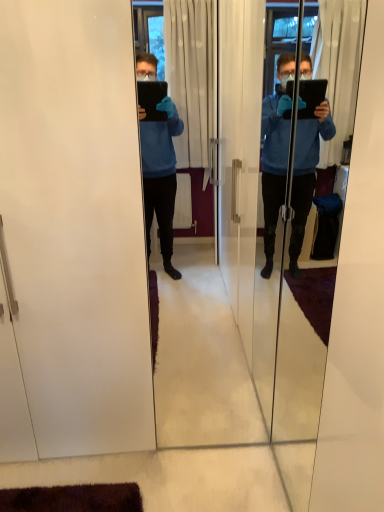
You are a GUI agent. You are given a task and a screenshot of the screen. Output one action in this format:
    pyautogui.click(x=<x>, y=<y>)
    Task: Click on the transparent glass tablet at center, which ranks as the first screen door in right-to-left order
    This screenshot has height=512, width=384.
    Given the screenshot: What is the action you would take?
    pyautogui.click(x=304, y=231)

This screenshot has height=512, width=384. What do you see at coordinates (304, 231) in the screenshot?
I see `transparent glass tablet at center, which ranks as the first screen door in right-to-left order` at bounding box center [304, 231].

Measure the distance between white matte screen door at left, the 1th screen door positioned from the left, and camera.

white matte screen door at left, the 1th screen door positioned from the left, is 1.20 meters from camera.

Locate an element on the screen. This screenshot has width=384, height=512. white matte screen door at left, placed as the second screen door when sorted from right to left is located at coordinates (72, 234).

What do you see at coordinates (72, 234) in the screenshot? I see `white matte screen door at left, the 1th screen door positioned from the left` at bounding box center [72, 234].

Identify the location of transparent glass tablet at center, which is the 2th screen door from left to right. The width and height of the screenshot is (384, 512). (304, 231).

Which object is positioned more to the left, white matte screen door at left, placed as the second screen door when sorted from right to left, or transparent glass tablet at center, which is the 2th screen door from left to right?

white matte screen door at left, placed as the second screen door when sorted from right to left.

Relative to transparent glass tablet at center, which is the 2th screen door from left to right, is white matte screen door at left, the 1th screen door positioned from the left, in front or behind?

white matte screen door at left, the 1th screen door positioned from the left, is behind transparent glass tablet at center, which is the 2th screen door from left to right.

Is point (59, 42) positioned behind point (279, 120)?

No, (59, 42) is in front of (279, 120).

From the image's perspective, between white matte screen door at left, placed as the second screen door when sorted from right to left, and transparent glass tablet at center, which ranks as the first screen door in right-to-left order, who is located below?

transparent glass tablet at center, which ranks as the first screen door in right-to-left order.

From a real-world perspective, is white matte screen door at left, the 1th screen door positioned from the left, above or below transparent glass tablet at center, which is the 2th screen door from left to right?

white matte screen door at left, the 1th screen door positioned from the left, is above transparent glass tablet at center, which is the 2th screen door from left to right.

Is white matte screen door at left, the 1th screen door positioned from the left, wider or thinner than transparent glass tablet at center, which ranks as the first screen door in right-to-left order?

In the image, white matte screen door at left, the 1th screen door positioned from the left, appears to be wider than transparent glass tablet at center, which ranks as the first screen door in right-to-left order.

Between white matte screen door at left, the 1th screen door positioned from the left, and transparent glass tablet at center, which ranks as the first screen door in right-to-left order, which one has less height?

Standing shorter between the two is transparent glass tablet at center, which ranks as the first screen door in right-to-left order.

Considering the sizes of objects white matte screen door at left, placed as the second screen door when sorted from right to left, and transparent glass tablet at center, which ranks as the first screen door in right-to-left order, in the image provided, who is bigger, white matte screen door at left, placed as the second screen door when sorted from right to left, or transparent glass tablet at center, which ranks as the first screen door in right-to-left order,?

white matte screen door at left, placed as the second screen door when sorted from right to left, is bigger.

Is white matte screen door at left, placed as the second screen door when sorted from right to left, inside or outside of transparent glass tablet at center, which is the 2th screen door from left to right?

white matte screen door at left, placed as the second screen door when sorted from right to left, exists outside the volume of transparent glass tablet at center, which is the 2th screen door from left to right.

Is white matte screen door at left, the 1th screen door positioned from the left, far away from transparent glass tablet at center, which ranks as the first screen door in right-to-left order?

Yes.

Could you tell me if white matte screen door at left, the 1th screen door positioned from the left, is turned towards transparent glass tablet at center, which ranks as the first screen door in right-to-left order?

No, white matte screen door at left, the 1th screen door positioned from the left, is not aimed at transparent glass tablet at center, which ranks as the first screen door in right-to-left order.

How many degrees apart are the facing directions of white matte screen door at left, placed as the second screen door when sorted from right to left, and transparent glass tablet at center, which ranks as the first screen door in right-to-left order?

They differ by 92.1 degrees in their facing directions.

Locate an element on the screen. This screenshot has height=512, width=384. screen door located above the transparent glass tablet at center, which ranks as the first screen door in right-to-left order (from a real-world perspective) is located at coordinates (x=72, y=234).

Is transparent glass tablet at center, which ranks as the first screen door in right-to-left order, to the right of white matte screen door at left, placed as the second screen door when sorted from right to left, from the viewer's perspective?

Yes.

Is transparent glass tablet at center, which is the 2th screen door from left to right, in front of white matte screen door at left, the 1th screen door positioned from the left?

That is True.

Does point (278, 150) appear closer or farther from the camera than point (6, 65)?

Point (278, 150) is positioned farther from the camera compared to point (6, 65).

From the image's perspective, is transparent glass tablet at center, which is the 2th screen door from left to right, located above or below white matte screen door at left, placed as the second screen door when sorted from right to left?

Based on their image positions, transparent glass tablet at center, which is the 2th screen door from left to right, is located beneath white matte screen door at left, placed as the second screen door when sorted from right to left.

Looking at this image, from a real-world perspective, is transparent glass tablet at center, which ranks as the first screen door in right-to-left order, positioned above or below white matte screen door at left, the 1th screen door positioned from the left?

Clearly, from a real-world perspective, transparent glass tablet at center, which ranks as the first screen door in right-to-left order, is below white matte screen door at left, the 1th screen door positioned from the left.

Between transparent glass tablet at center, which ranks as the first screen door in right-to-left order, and white matte screen door at left, placed as the second screen door when sorted from right to left, which one has larger width?

white matte screen door at left, placed as the second screen door when sorted from right to left.

Between transparent glass tablet at center, which is the 2th screen door from left to right, and white matte screen door at left, placed as the second screen door when sorted from right to left, which one has more height?

white matte screen door at left, placed as the second screen door when sorted from right to left.

Considering the sizes of transparent glass tablet at center, which ranks as the first screen door in right-to-left order, and white matte screen door at left, placed as the second screen door when sorted from right to left, in the image, is transparent glass tablet at center, which ranks as the first screen door in right-to-left order, bigger or smaller than white matte screen door at left, placed as the second screen door when sorted from right to left,?

Considering their sizes, transparent glass tablet at center, which ranks as the first screen door in right-to-left order, takes up less space than white matte screen door at left, placed as the second screen door when sorted from right to left.

Is transparent glass tablet at center, which ranks as the first screen door in right-to-left order, located outside white matte screen door at left, placed as the second screen door when sorted from right to left?

transparent glass tablet at center, which ranks as the first screen door in right-to-left order, is positioned outside white matte screen door at left, placed as the second screen door when sorted from right to left.

In the scene shown: Are transparent glass tablet at center, which is the 2th screen door from left to right, and white matte screen door at left, the 1th screen door positioned from the left, located far from each other?

Absolutely, transparent glass tablet at center, which is the 2th screen door from left to right, is distant from white matte screen door at left, the 1th screen door positioned from the left.

Could you tell me if transparent glass tablet at center, which ranks as the first screen door in right-to-left order, is turned towards white matte screen door at left, the 1th screen door positioned from the left?

No, transparent glass tablet at center, which ranks as the first screen door in right-to-left order, is not turned towards white matte screen door at left, the 1th screen door positioned from the left.

At what (x,y) coordinates should I click in order to perform the action: click on screen door below the white matte screen door at left, placed as the second screen door when sorted from right to left (from a real-world perspective). Please return your answer as a coordinate pair (x, y). This screenshot has width=384, height=512. Looking at the image, I should click on (304, 231).

Locate an element on the screen. screen door on the left of transparent glass tablet at center, which is the 2th screen door from left to right is located at coordinates click(72, 234).

You are a GUI agent. You are given a task and a screenshot of the screen. Output one action in this format:
    pyautogui.click(x=<x>, y=<y>)
    Task: Click on the screen door located behind the transparent glass tablet at center, which ranks as the first screen door in right-to-left order
    This screenshot has width=384, height=512.
    Given the screenshot: What is the action you would take?
    pyautogui.click(x=72, y=234)